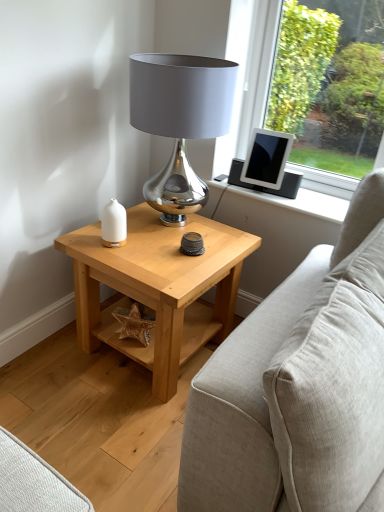
The width and height of the screenshot is (384, 512). Identify the location of unoccupied area in front of shiny metallic lamp at center. (162, 261).